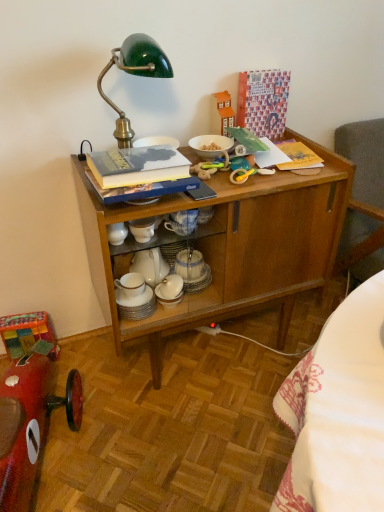
Question: Looking at the image, does shiny red toy car at lower left seem bigger or smaller compared to white glossy bowl at upper center, arranged as the second tableware when ordered from the bottom?

Choices:
 (A) big
 (B) small

Answer: (A)

Question: From the image's perspective, is shiny red toy car at lower left positioned above or below white glossy bowl at upper center, arranged as the second tableware when ordered from the bottom?

Choices:
 (A) below
 (B) above

Answer: (A)

Question: Which of these objects is positioned closest to the wooden cabinet at center?

Choices:
 (A) white glossy bowl at upper center, arranged as the second tableware when ordered from the bottom
 (B) shiny red toy car at lower left
 (C) white porcelain cups at center, which is the first tableware from left to right
 (D) hardcover book at upper center

Answer: (D)

Question: Estimate the real-world distances between objects in this image. Which object is closer to the shiny red toy car at lower left?

Choices:
 (A) hardcover book at upper center
 (B) wooden cabinet at center
 (C) white porcelain cups at center, which ranks as the second tableware in top-to-bottom order
 (D) white glossy bowl at upper center, the second tableware in the left-to-right sequence

Answer: (C)